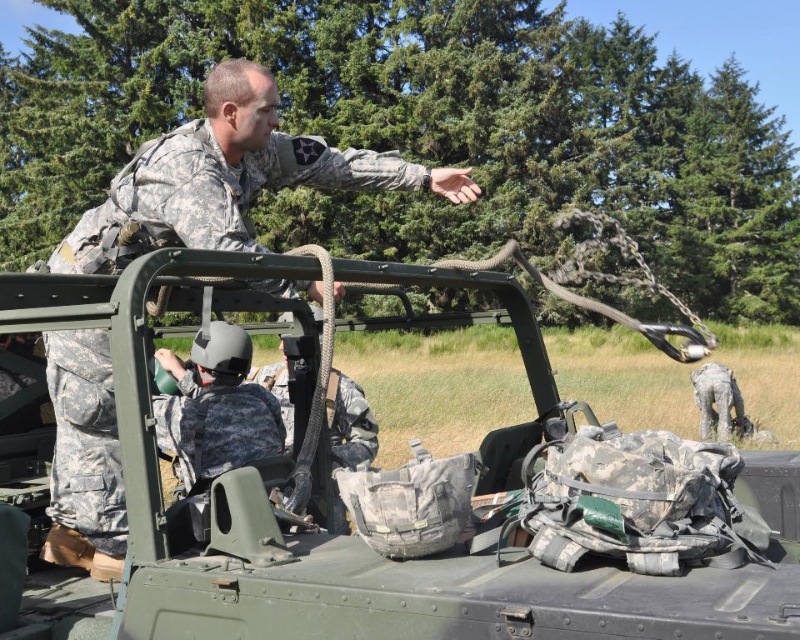
Question: Which point is closer to the camera?

Choices:
 (A) camouflage uniform at upper left
 (B) camouflage fabric tank at upper center

Answer: (B)

Question: Is camouflage fabric tank at upper center positioned in front of camouflage uniform at upper left?

Choices:
 (A) no
 (B) yes

Answer: (B)

Question: Which of the following is the closest to the observer?

Choices:
 (A) coord(544,516)
 (B) coord(122,488)

Answer: (A)

Question: Does camouflage fabric tank at upper center have a smaller size compared to camouflage uniform at upper left?

Choices:
 (A) no
 (B) yes

Answer: (A)

Question: Where is camouflage fabric tank at upper center located in relation to camouflage uniform at upper left in the image?

Choices:
 (A) below
 (B) above

Answer: (A)